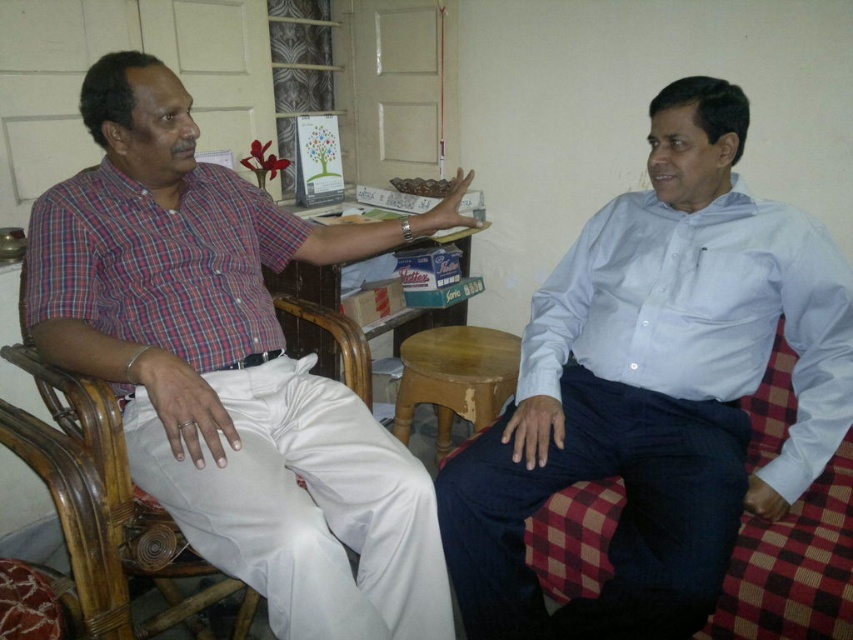
Can you confirm if matte plaid shirt at left is positioned to the left of white fabric armchair at left?

Incorrect, matte plaid shirt at left is not on the left side of white fabric armchair at left.

This screenshot has width=853, height=640. Describe the element at coordinates (231, 369) in the screenshot. I see `matte plaid shirt at left` at that location.

Who is more forward, (136, 74) or (357, 365)?

Point (136, 74)

This screenshot has width=853, height=640. In order to click on matte plaid shirt at left in this screenshot , I will do `click(231, 369)`.

Is light blue cotton shirt at right below white fabric armchair at left?

No.

Which is more to the left, light blue cotton shirt at right or white fabric armchair at left?

From the viewer's perspective, white fabric armchair at left appears more on the left side.

Is point (695, 109) farther from viewer compared to point (177, 554)?

Yes, it is behind point (177, 554).

This screenshot has height=640, width=853. What are the coordinates of `light blue cotton shirt at right` in the screenshot? It's located at (654, 388).

The height and width of the screenshot is (640, 853). What are the coordinates of `checkered fabric armchair at right` in the screenshot? It's located at (793, 566).

Can you confirm if checkered fabric armchair at right is smaller than white fabric armchair at left?

Correct, checkered fabric armchair at right occupies less space than white fabric armchair at left.

I want to click on checkered fabric armchair at right, so click(x=793, y=566).

Find the location of `checkered fabric armchair at right`. checkered fabric armchair at right is located at coordinates (793, 566).